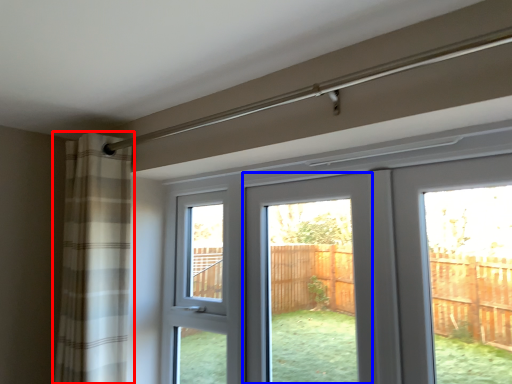
Question: Which of the following is the closest to the observer, curtain (highlighted by a red box) or screen door (highlighted by a blue box)?

Choices:
 (A) curtain
 (B) screen door

Answer: (B)